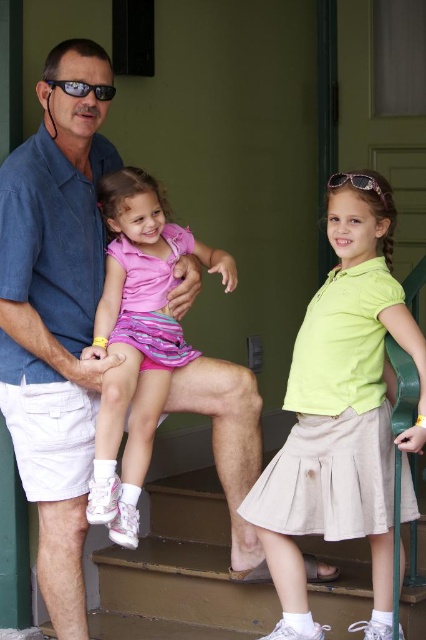
Looking at this image, in the scene described, the adult male is wearing a lime green polo shirt at center and the younger girl has a pink striped skirt at center. Based on their positions, which clothing item is positioned lower on the image?

The lime green polo shirt at center is located below the pink striped skirt at center, so it is positioned lower in the image.